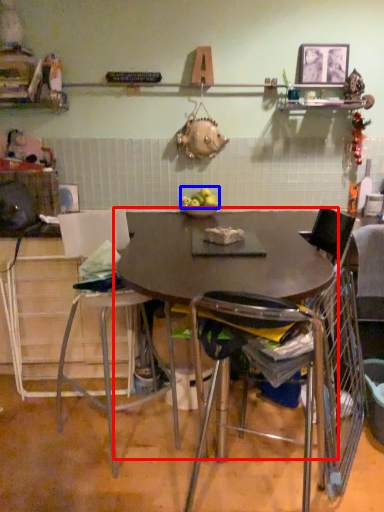
Question: Which object appears closest to the camera in this image, table (highlighted by a red box) or apple (highlighted by a blue box)?

Choices:
 (A) table
 (B) apple

Answer: (A)